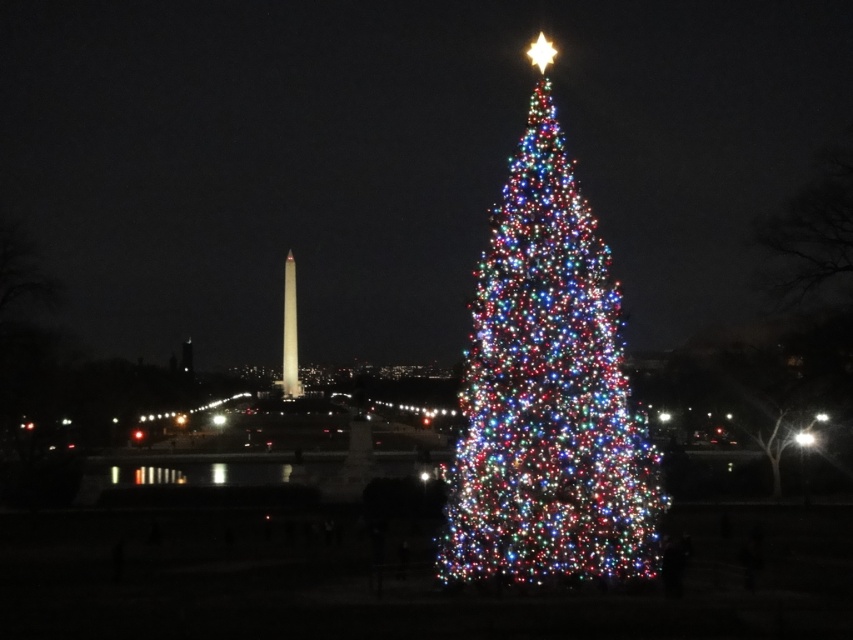
Consider the image. You are standing in front of the Christmas tree and want to take a photo of the Washington Monument in the background. You notice two points marked on your camera screen at coordinates point (546, 129) and point (289, 278). Which point should you focus on to ensure the Washington Monument is in sharp focus?

You should focus on point (289, 278) because it is farther away from the camera than point (546, 129), and the Washington Monument is in the background, so focusing on the farther point will ensure it is in sharp focus.

You are standing at the point marked as point (547, 390) in the image. What object are you standing on?

The point (547, 390) corresponds to the illuminated plastic christmas tree at center, so you are standing on the illuminated plastic christmas tree at center.